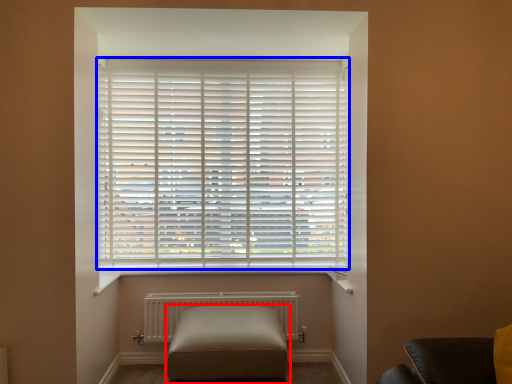
Question: Which object appears farthest to the camera in this image, furniture (highlighted by a red box) or window blind (highlighted by a blue box)?

Choices:
 (A) furniture
 (B) window blind

Answer: (B)